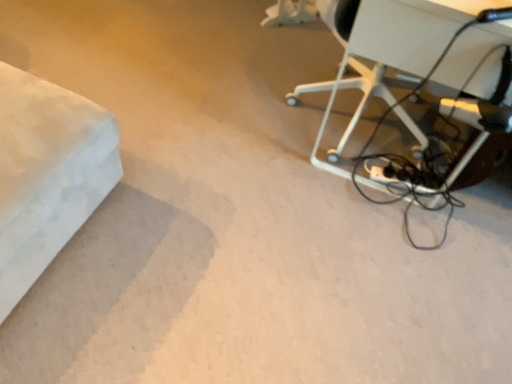
Question: Could you tell me if white plastic table at upper right is facing black matte extension cord at lower right?

Choices:
 (A) no
 (B) yes

Answer: (A)

Question: Is white plastic table at upper right next to black matte extension cord at lower right and touching it?

Choices:
 (A) yes
 (B) no

Answer: (B)

Question: Is the position of white plastic table at upper right more distant than that of black matte extension cord at lower right?

Choices:
 (A) no
 (B) yes

Answer: (A)

Question: From the image's perspective, is white plastic table at upper right above black matte extension cord at lower right?

Choices:
 (A) no
 (B) yes

Answer: (B)

Question: Is white plastic table at upper right bigger than black matte extension cord at lower right?

Choices:
 (A) no
 (B) yes

Answer: (B)

Question: From a real-world perspective, is white plastic table at upper right physically below black matte extension cord at lower right?

Choices:
 (A) yes
 (B) no

Answer: (B)

Question: Is black matte extension cord at lower right thinner than white plastic table at upper right?

Choices:
 (A) yes
 (B) no

Answer: (A)

Question: From the image's perspective, is black matte extension cord at lower right over white plastic table at upper right?

Choices:
 (A) no
 (B) yes

Answer: (A)

Question: Considering the relative positions of black matte extension cord at lower right and white plastic table at upper right in the image provided, is black matte extension cord at lower right behind white plastic table at upper right?

Choices:
 (A) no
 (B) yes

Answer: (B)

Question: From a real-world perspective, is black matte extension cord at lower right located beneath white plastic table at upper right?

Choices:
 (A) yes
 (B) no

Answer: (A)

Question: Does black matte extension cord at lower right have a smaller size compared to white plastic table at upper right?

Choices:
 (A) no
 (B) yes

Answer: (B)

Question: Is black matte extension cord at lower right to the left of white plastic table at upper right from the viewer's perspective?

Choices:
 (A) no
 (B) yes

Answer: (B)

Question: From the image's perspective, is white plastic table at upper right positioned above or below black matte extension cord at lower right?

Choices:
 (A) above
 (B) below

Answer: (A)